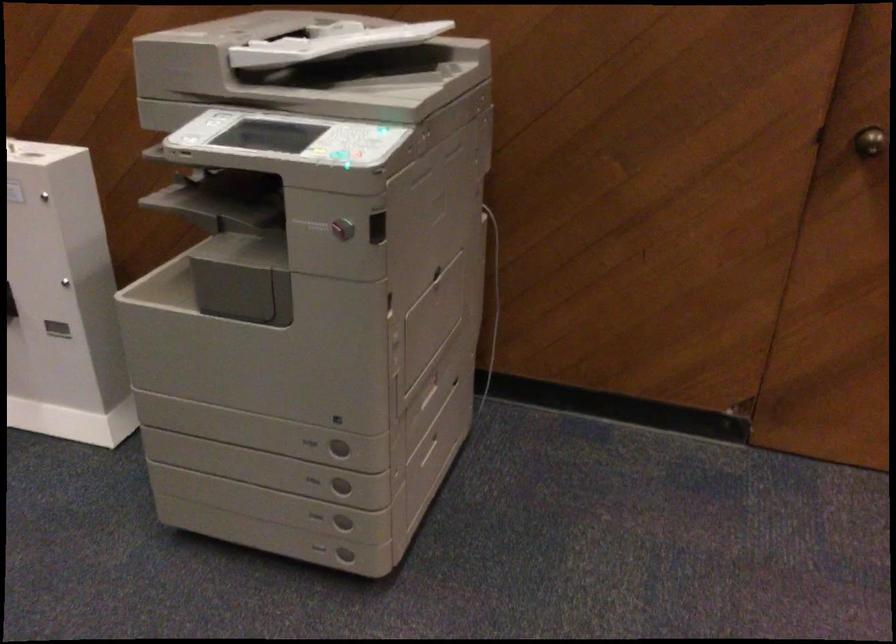
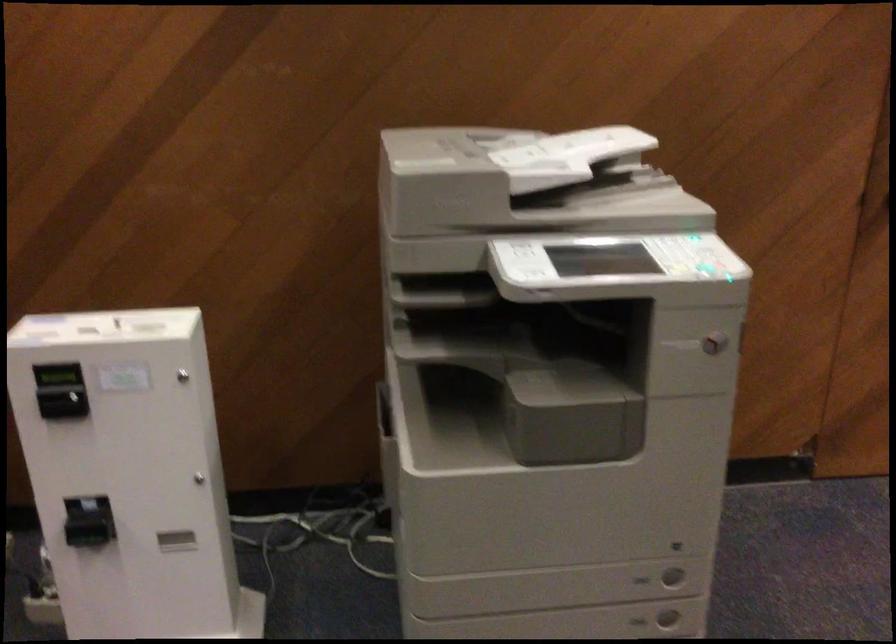
Where in the second image is the point corresponding to point (340, 162) from the first image?

(698, 266)